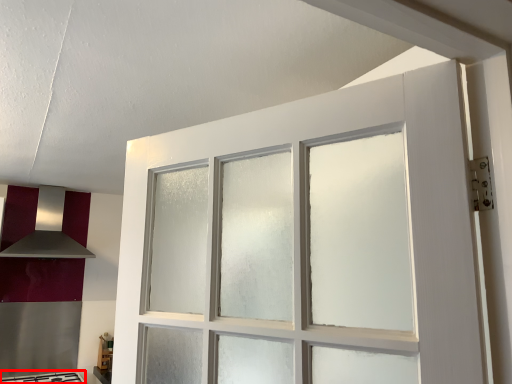
Question: From the image's perspective, what is the correct spatial positioning of gas stove (annotated by the red box) in reference to exhaust hood?

Choices:
 (A) above
 (B) below

Answer: (B)